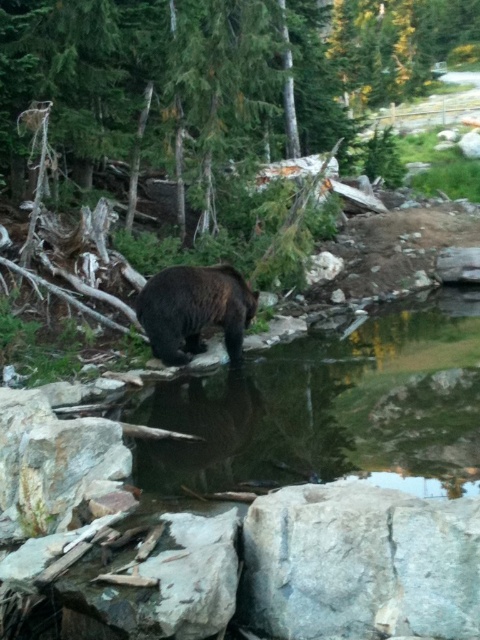
You are a photographer standing at the edge of the water. You want to take a photo that includes both the point at coordinates point (192, 480) and point (167, 314). Based on their positions, which point is closer to you, the photographer?

Point (192, 480) is in front of point (167, 314), so the point closer to you is point (192, 480).

You are a wildlife photographer standing at the edge of the forest. You want to take a photo of the brown furry bear at center and the transparent water at center. If your camera has a minimum focus distance of 3 feet, will you be able to capture both subjects clearly in the same shot?

The transparent water at center is 3.37 feet away from the brown furry bear at center. Since the minimum focus distance is 3 feet, the camera can focus on both subjects as they are within the required distance.